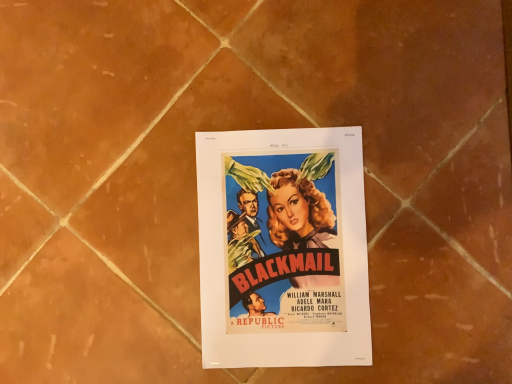
The image size is (512, 384). In order to click on matte paper poster at center in this screenshot , I will do `click(283, 248)`.

Measure the distance between point (x=228, y=326) and camera.

Point (x=228, y=326) is 20.91 inches away from camera.

The height and width of the screenshot is (384, 512). What do you see at coordinates (283, 248) in the screenshot?
I see `matte paper poster at center` at bounding box center [283, 248].

Image resolution: width=512 pixels, height=384 pixels. Find the location of `matte paper poster at center`. matte paper poster at center is located at coordinates (283, 248).